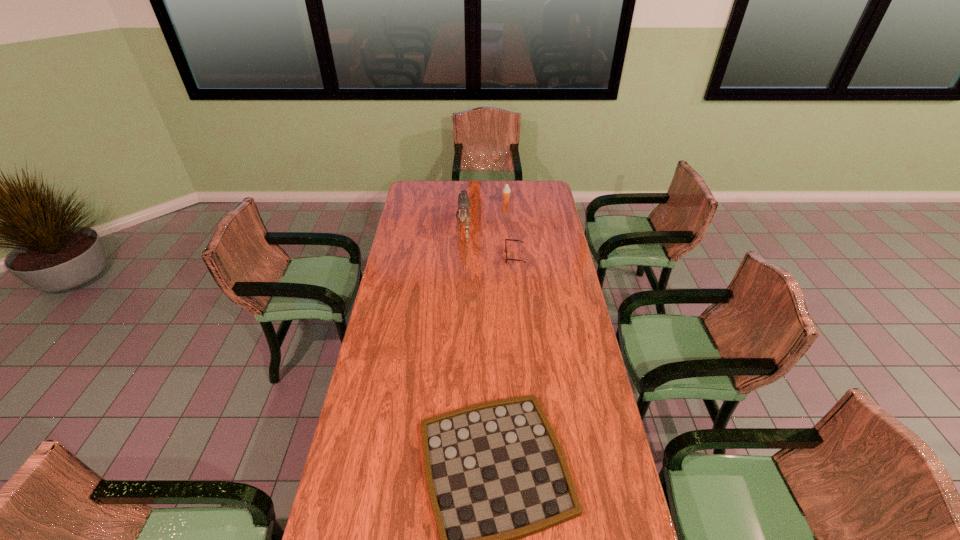
In the image, there is a desktop. Where is `vacant region at the far edge`? This screenshot has height=540, width=960. vacant region at the far edge is located at coordinates (519, 184).

Locate an element on the screen. This screenshot has width=960, height=540. vacant space at the left edge of the desktop is located at coordinates (378, 392).

Where is `free space at the right edge of the desktop`? The image size is (960, 540). free space at the right edge of the desktop is located at coordinates coord(591,411).

In the image, there is a desktop. In order to click on vacant space at the far left corner in this screenshot , I will do `click(417, 198)`.

Locate an element on the screen. This screenshot has width=960, height=540. vacant space that's between the sunglasses and the tallest object is located at coordinates (490, 239).

Where is `free space between the second tallest object and the cat`? free space between the second tallest object and the cat is located at coordinates (485, 212).

At what (x,y) coordinates should I click in order to perform the action: click on free spot between the cat and the second tallest object. Please return your answer as a coordinate pair (x, y). Looking at the image, I should click on (485, 212).

Identify the location of free space that is in between the cat and the icecream. (x=485, y=212).

This screenshot has width=960, height=540. I want to click on free spot between the icecream and the cat, so click(485, 212).

Where is `unoccupied position between the third farthest object and the cat`? This screenshot has height=540, width=960. unoccupied position between the third farthest object and the cat is located at coordinates (490, 239).